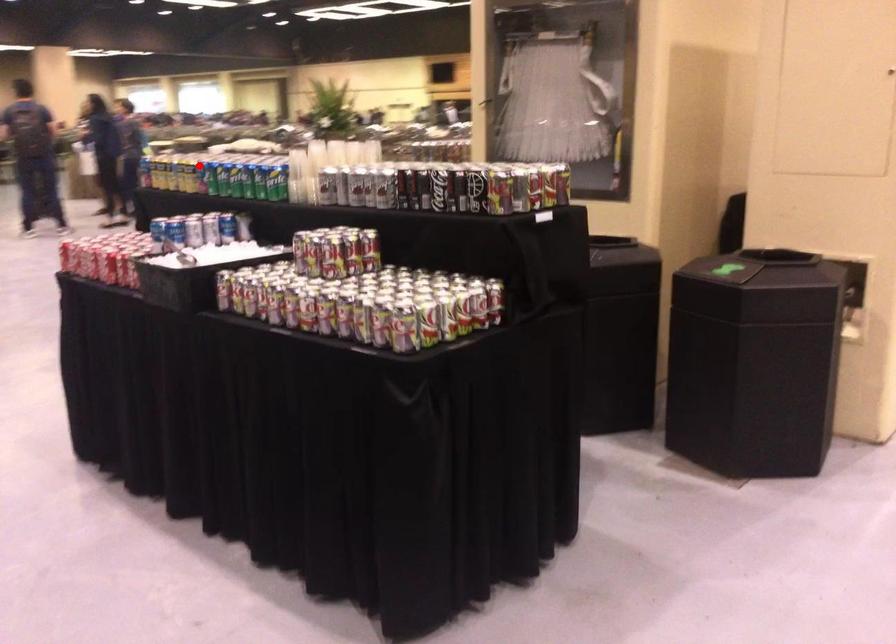
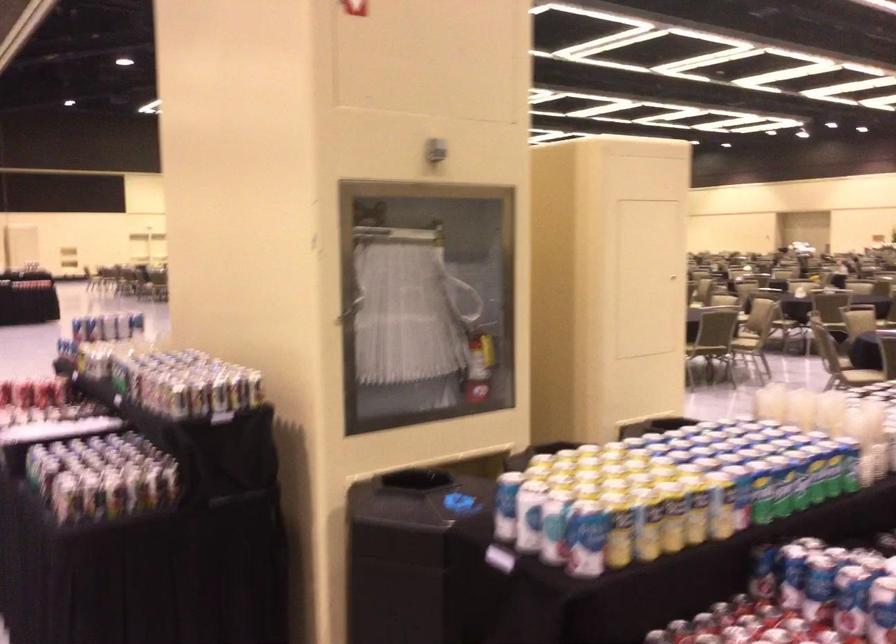
Question: I am providing you with two images of the same scene from different viewpoints. A red point is marked on the first image. Can you still see the location of the red point in image 2?

Choices:
 (A) Yes
 (B) No

Answer: (A)